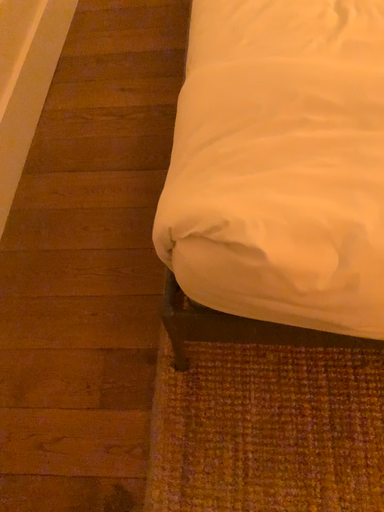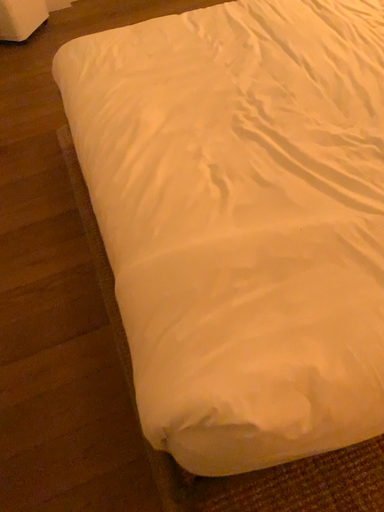
Question: Which way did the camera rotate in the video?

Choices:
 (A) rotated upward
 (B) rotated downward

Answer: (A)